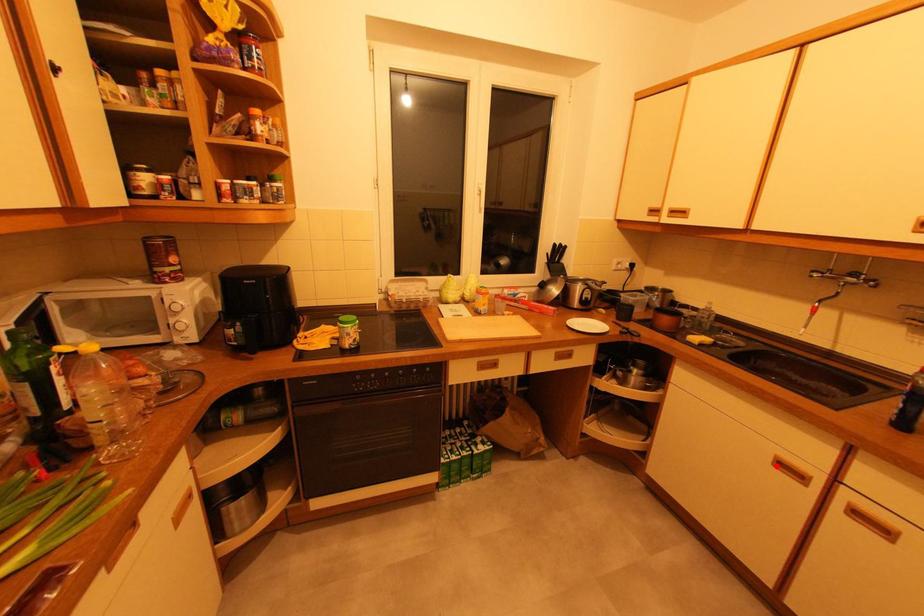
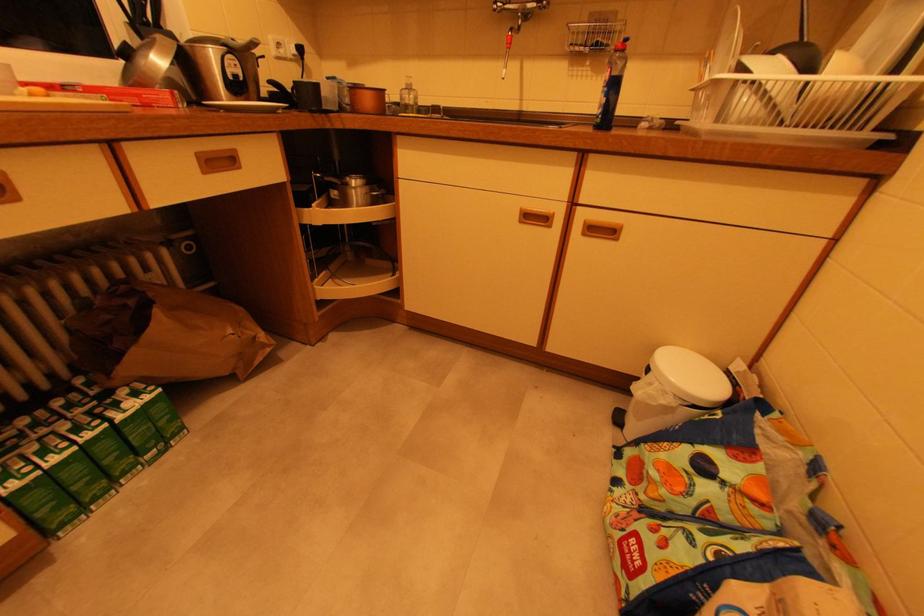
Find the pixel in the second image that matches the highlighted location in the first image.

(523, 223)